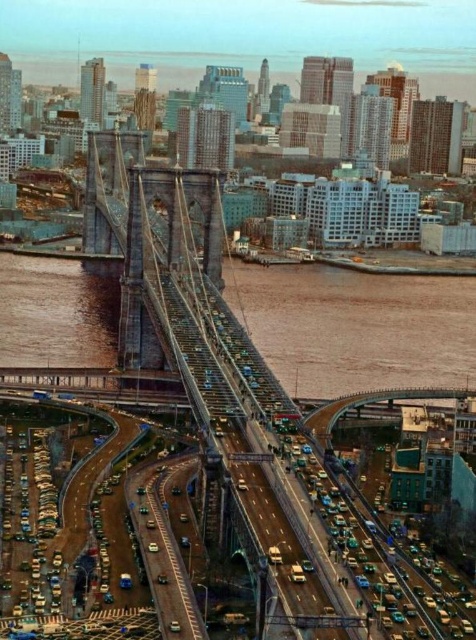
Question: Can you confirm if gray metallic suspension bridge at center is positioned to the left of brown water at center?

Choices:
 (A) yes
 (B) no

Answer: (B)

Question: Among these points, which one is nearest to the camera?

Choices:
 (A) (319, 264)
 (B) (443, 618)

Answer: (B)

Question: Does gray metallic suspension bridge at center appear on the right side of brown water at center?

Choices:
 (A) no
 (B) yes

Answer: (B)

Question: Does gray metallic suspension bridge at center appear over brown water at center?

Choices:
 (A) yes
 (B) no

Answer: (A)

Question: Which of the following is the farthest from the observer?

Choices:
 (A) brown water at center
 (B) gray metallic suspension bridge at center

Answer: (A)